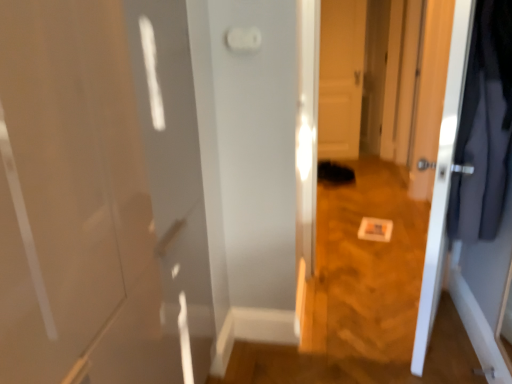
Question: Should I look upward or downward to see white glossy door at right, which appears as the 1th door when viewed from the front?

Choices:
 (A) down
 (B) up

Answer: (B)

Question: Is white plastic light switch at upper center closer to the viewer compared to white glossy door at center, which appears as the 2th door when viewed from the front?

Choices:
 (A) yes
 (B) no

Answer: (A)

Question: Is white plastic light switch at upper center facing away from white glossy door at center, which appears as the 2th door when viewed from the front?

Choices:
 (A) no
 (B) yes

Answer: (B)

Question: Is white plastic light switch at upper center facing towards white glossy door at center, acting as the first door starting from the back?

Choices:
 (A) no
 (B) yes

Answer: (A)

Question: Is white glossy door at center, acting as the first door starting from the back, located within white plastic light switch at upper center?

Choices:
 (A) yes
 (B) no

Answer: (B)

Question: Can you confirm if white plastic light switch at upper center is shorter than white glossy door at center, which appears as the 2th door when viewed from the front?

Choices:
 (A) no
 (B) yes

Answer: (B)

Question: Is white plastic light switch at upper center bigger than white glossy door at center, acting as the first door starting from the back?

Choices:
 (A) yes
 (B) no

Answer: (B)

Question: Can you confirm if white glossy door at right, which appears as the 1th door when viewed from the front, is wider than dark gray fabric coat at right?

Choices:
 (A) yes
 (B) no

Answer: (B)

Question: Can you confirm if white glossy door at right, which is the second door in back-to-front order, is positioned to the right of dark gray fabric coat at right?

Choices:
 (A) yes
 (B) no

Answer: (B)

Question: From the image's perspective, is white glossy door at right, which is the second door in back-to-front order, located beneath dark gray fabric coat at right?

Choices:
 (A) yes
 (B) no

Answer: (A)

Question: Considering the relative positions of white glossy door at right, which is the second door in back-to-front order, and dark gray fabric coat at right in the image provided, is white glossy door at right, which is the second door in back-to-front order, behind dark gray fabric coat at right?

Choices:
 (A) no
 (B) yes

Answer: (B)

Question: From a real-world perspective, is white glossy door at right, which is the second door in back-to-front order, beneath dark gray fabric coat at right?

Choices:
 (A) no
 (B) yes

Answer: (B)

Question: Is white glossy door at right, which is the second door in back-to-front order, in contact with dark gray fabric coat at right?

Choices:
 (A) yes
 (B) no

Answer: (B)

Question: Considering the relative sizes of white plastic light switch at upper center and dark gray fabric coat at right in the image provided, is white plastic light switch at upper center thinner than dark gray fabric coat at right?

Choices:
 (A) no
 (B) yes

Answer: (B)